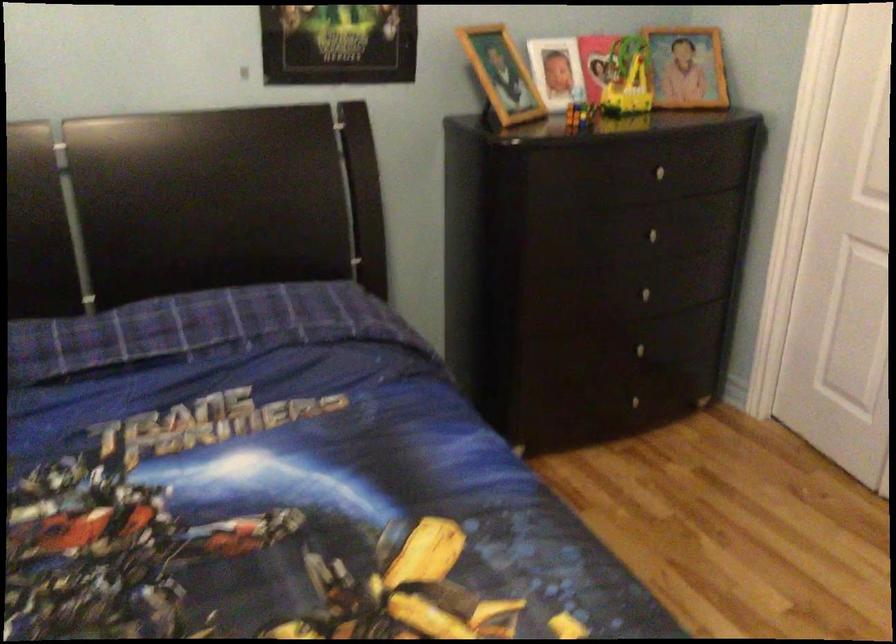
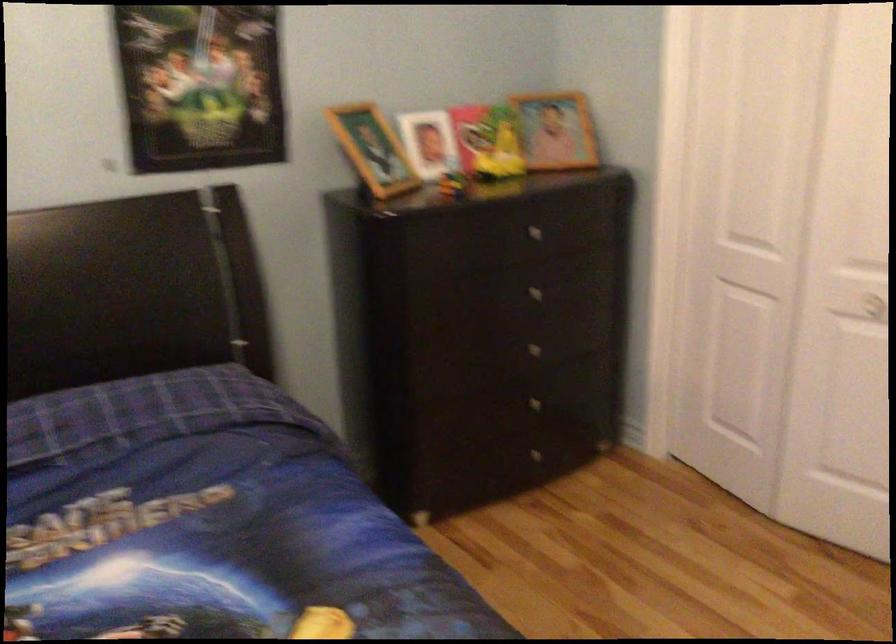
Find the pixel in the second image that matches point (502, 77) in the first image.

(373, 149)